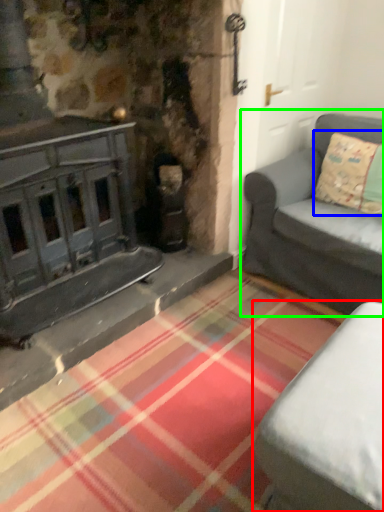
Question: Which is farther away from studio couch (highlighted by a red box)? pillow (highlighted by a blue box) or studio couch (highlighted by a green box)?

Choices:
 (A) pillow
 (B) studio couch

Answer: (A)